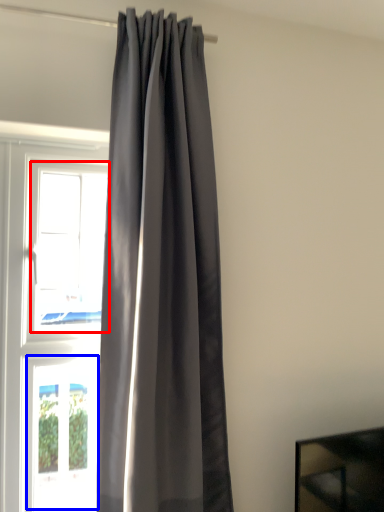
Question: Which object appears farthest to the camera in this image, window (highlighted by a red box) or window (highlighted by a blue box)?

Choices:
 (A) window
 (B) window

Answer: (B)